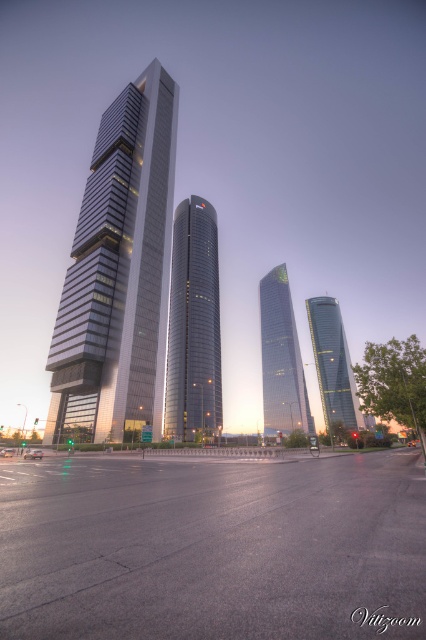
You are an architect analyzing the urban skyline. Based on the scene, which of the two skyscrapers, the metallic glass skyscraper at left or the shiny glass skyscraper at center, has a larger physical size?

The metallic glass skyscraper at left is bigger than the shiny glass skyscraper at center.

You are standing in the middle of the city square and see the metallic glass skyscraper at left and the glassy reflective skyscraper at right. Which one is located to the east if the sun is setting in the west?

The metallic glass skyscraper at left is located to the east because it is positioned on the left side of the glassy reflective skyscraper at right, and since the sun is setting in the west, the east would be to the left from the observer standing in the city square facing the horizon.